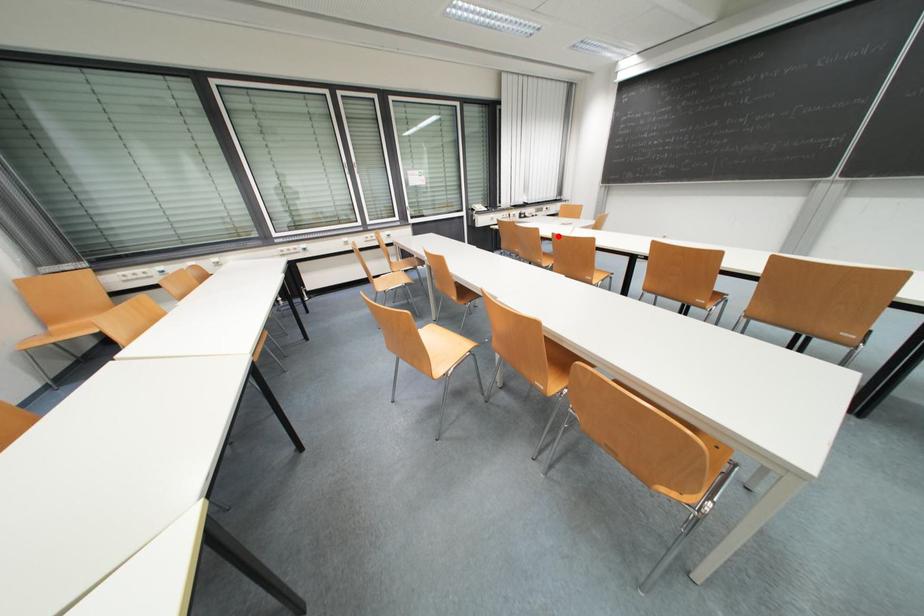
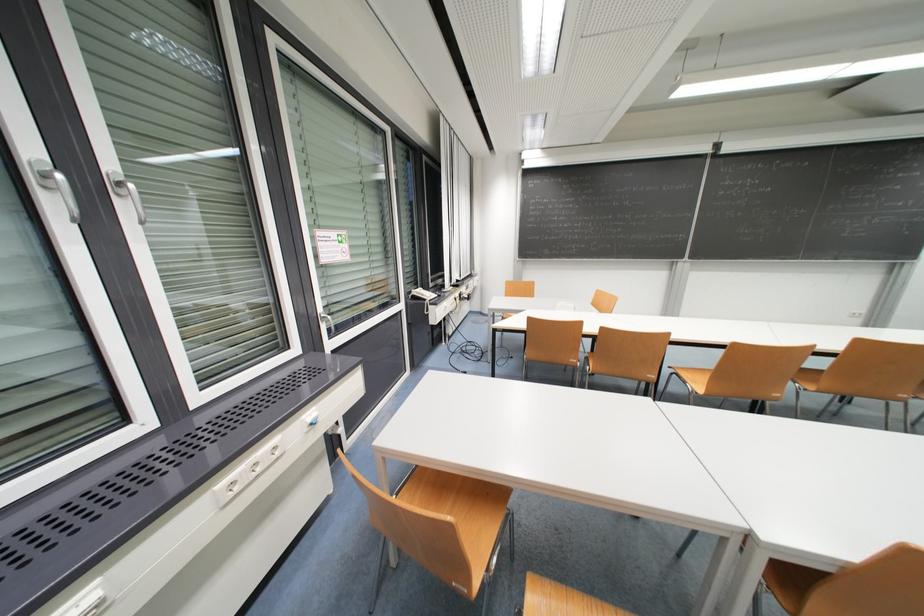
Where in the second image is the point corresponding to the highlighted location from the first image?

(739, 346)